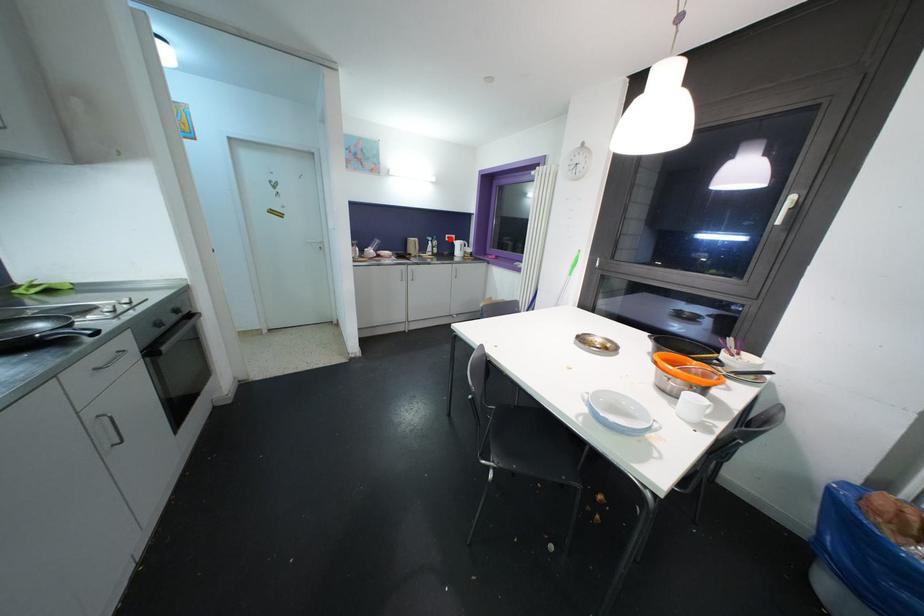
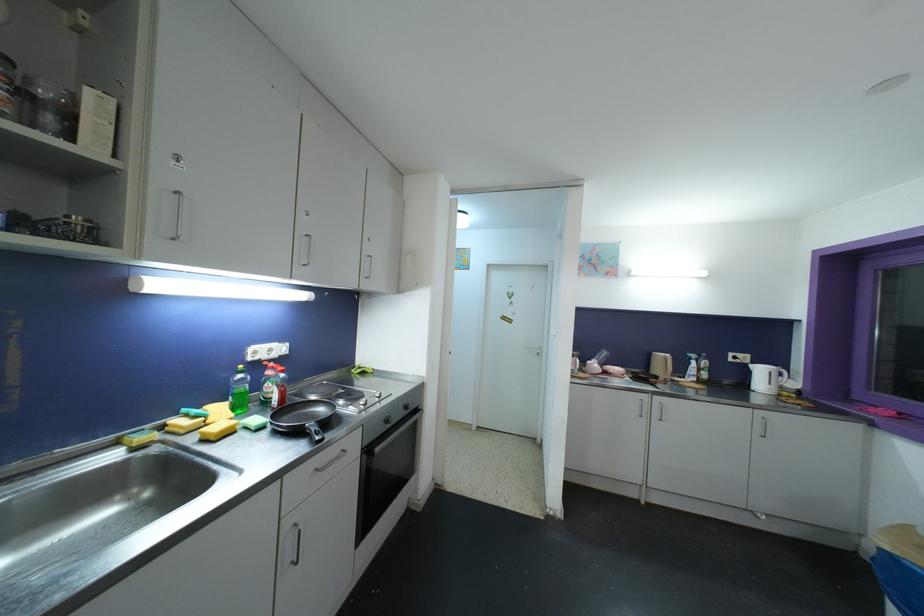
Locate, in the second image, the point that corresponds to the highlighted location in the first image.

(734, 357)